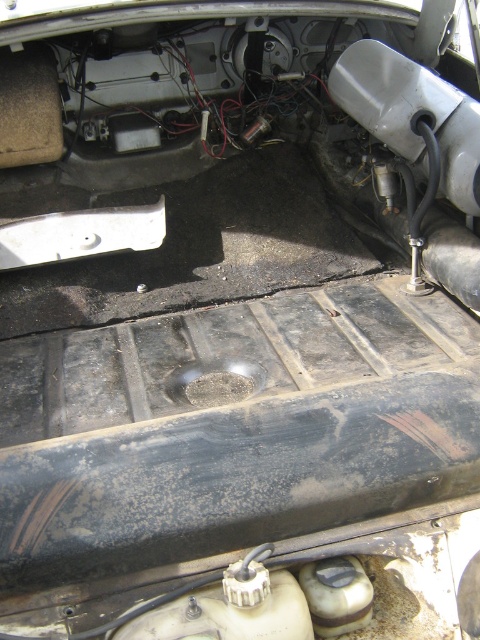
You are a mechanic working on a vehicle. You need to install a new bumper. The matte plastic bumper at upper center and the white matte bumper at center are both available. Which bumper should you choose if you want the one that is taller?

The matte plastic bumper at upper center is much taller than the white matte bumper at center, so you should choose the matte plastic bumper at upper center.

You are a mechanic working on a car. You need to reach the point at coordinates point (429, 104) from your current position. Your tool box is 1.5 meters long. Can you reach the point with your tool box?

The distance between you and the point (429, 104) is 1.43 meters, so yes, the tool box can reach the point since it is shorter than the tool box length.

You are a mechanic working on a car. You need to install a new sensor between the matte plastic bumper at upper center and the white matte bumper at center. The sensor requires 30 inches of space to fit. Based on the image, will there be enough space?

The matte plastic bumper at upper center and white matte bumper at center are 28.86 inches apart, which is less than the required 30 inches. Therefore, there is not enough space to install the sensor between them.